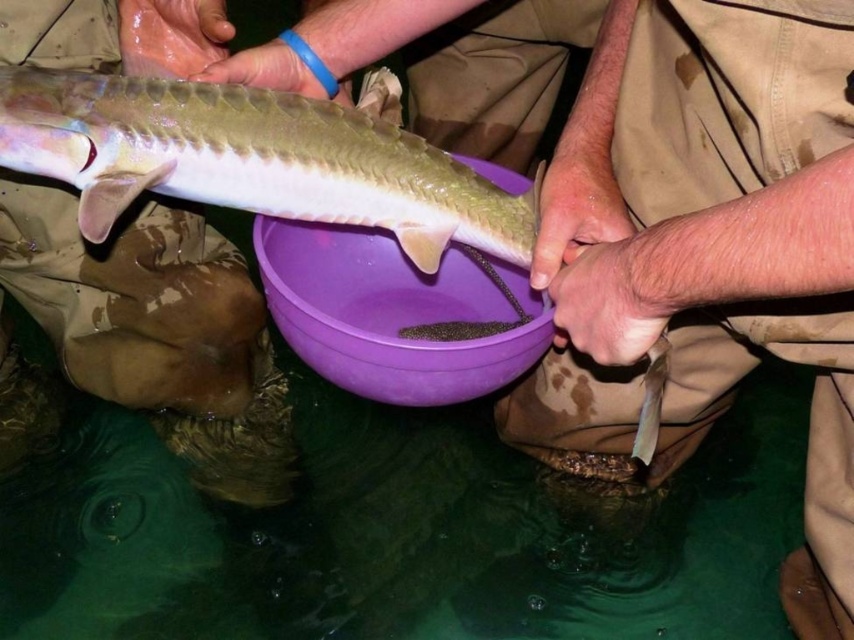
Question: Does smooth beige pants at upper left appear under shiny silver fish at center?

Choices:
 (A) no
 (B) yes

Answer: (B)

Question: Which of the following is the closest to the observer?

Choices:
 (A) smooth beige pants at upper left
 (B) shiny silver fish at center

Answer: (B)

Question: Which point is closer to the camera?

Choices:
 (A) smooth beige pants at upper left
 (B) shiny silver fish at center

Answer: (B)

Question: Which point is farther to the camera?

Choices:
 (A) (186, 376)
 (B) (80, 84)

Answer: (A)

Question: Can you confirm if smooth beige pants at upper left is bigger than shiny silver fish at center?

Choices:
 (A) no
 (B) yes

Answer: (B)

Question: Does smooth beige pants at upper left appear on the right side of shiny silver fish at center?

Choices:
 (A) yes
 (B) no

Answer: (B)